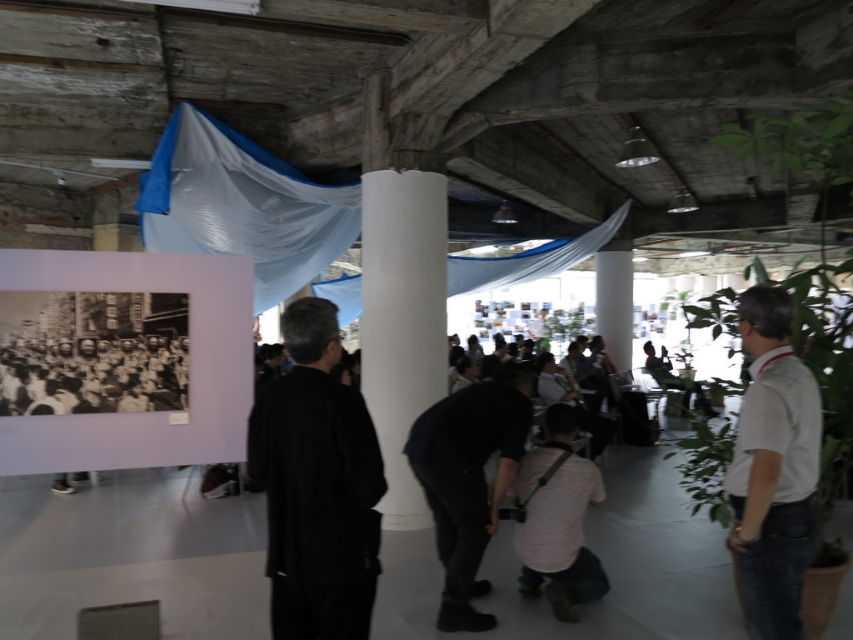
You are an event organizer who needs to place a decorative item exactly at the center of the room. However, there is a black matte jacket at center in the way. Can you confirm the jacket is exactly at the center of the room?

The black matte jacket at center is positioned at point (316, 484), which is not the exact center of the room. Therefore, the jacket is not exactly at the center of the room.

You are standing in the exhibition space and want to take a photo of the two points mentioned. Which point, point [317,308] or point [445,557], will appear larger in your camera view?

Point [317,308] is closer to the camera than point [445,557], so it will appear larger in your camera view.